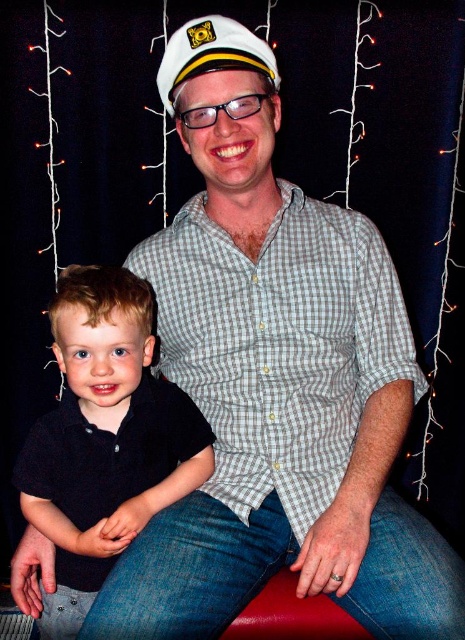
You are a photographer setting up for a portrait. You need to decide which object, the black cotton shirt at lower left or the white matte sailor hat at upper center, requires more space in your frame. Based on their sizes, which one should you prioritize to ensure it fits properly?

The black cotton shirt at lower left is larger in size than the white matte sailor hat at upper center, so you should prioritize including the black cotton shirt at lower left in your frame to ensure it fits properly.

What is the color of the shirt worn by the person located at the coordinates point [105,438]?

The point [105,438] indicates the black cotton shirt at lower left, so the color is black.

Consider the image. You are designing a poster and want to place the black cotton shirt at lower left and the white matte sailor hat at upper center. Which object should you make wider in your design to maintain the original proportions?

The black cotton shirt at lower left should be made wider in your design since it is wider than the white matte sailor hat at upper center according to the scene description.